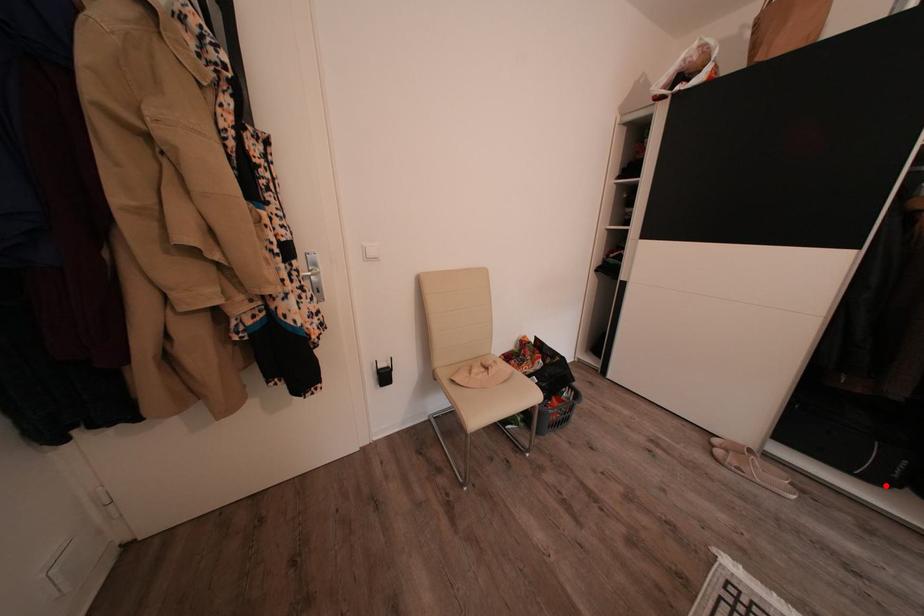
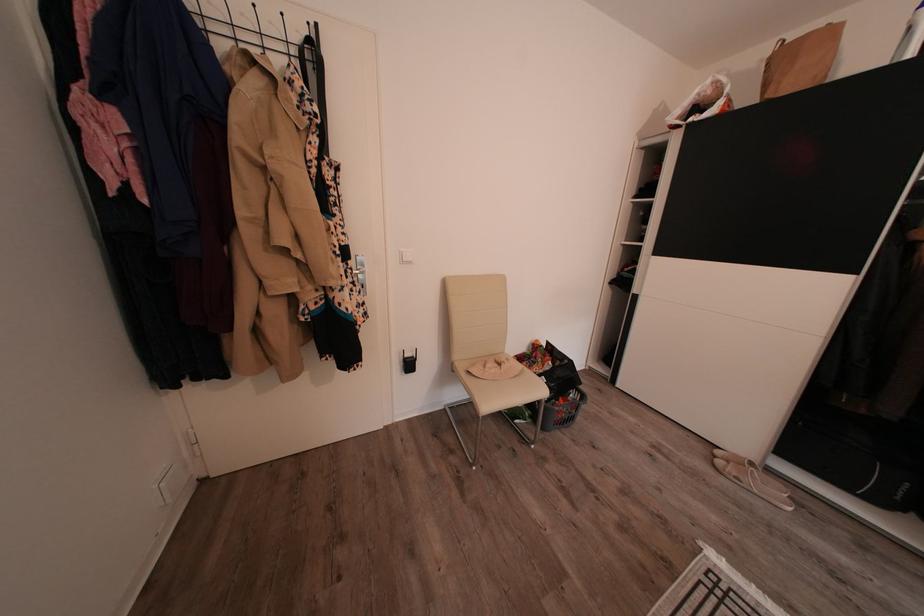
Where in the second image is the point corresponding to the highlighted location from the first image?

(888, 507)